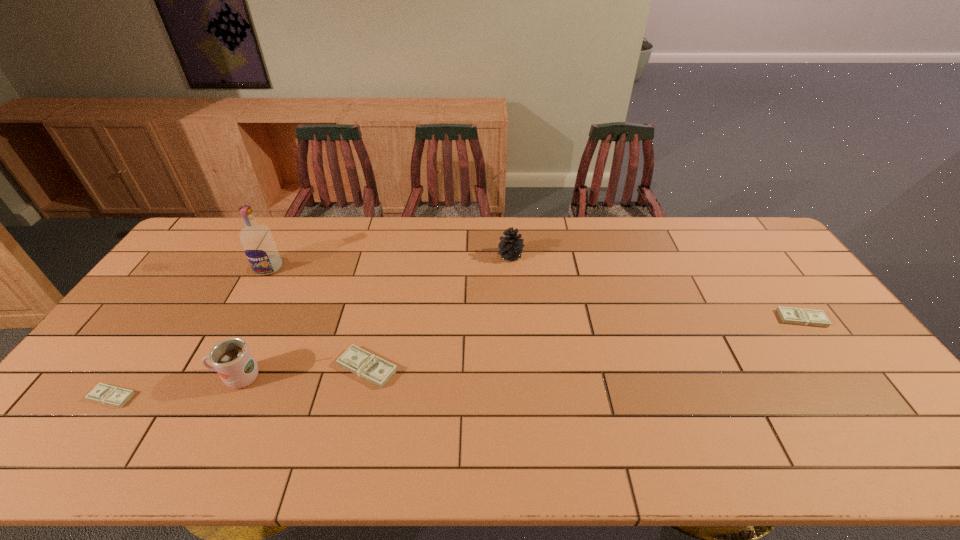
The height and width of the screenshot is (540, 960). In order to click on blank region between the fifth object from left to right and the leftmost money in this screenshot , I will do `click(311, 326)`.

The width and height of the screenshot is (960, 540). In order to click on free space between the second shortest object and the cup in this screenshot , I will do `click(519, 348)`.

Identify the location of vacant region between the tallest object and the fourth tallest object. This screenshot has width=960, height=540. (318, 318).

Locate an element on the screen. The width and height of the screenshot is (960, 540). free space between the tallest object and the second object from right to left is located at coordinates (390, 262).

The height and width of the screenshot is (540, 960). I want to click on blank region between the second tallest money and the fourth shortest object, so click(656, 287).

You are a GUI agent. You are given a task and a screenshot of the screen. Output one action in this format:
    pyautogui.click(x=<x>, y=<y>)
    Task: Click on the empty space that is in between the tallest object and the rightmost object
    
    Given the screenshot: What is the action you would take?
    pyautogui.click(x=535, y=293)

Select which object is the fifth closest to the vodka. Please provide its 2D coordinates. Your answer should be formatted as a tuple, i.e. [(x, y)], where the tuple contains the x and y coordinates of a point satisfying the conditions above.

[(800, 316)]

Identify which object is the fifth closest to the leftmost object. Please provide its 2D coordinates. Your answer should be formatted as a tuple, i.e. [(x, y)], where the tuple contains the x and y coordinates of a point satisfying the conditions above.

[(800, 316)]

Identify the location of the second closest money relative to the leftmost object. Image resolution: width=960 pixels, height=540 pixels. (800, 316).

This screenshot has width=960, height=540. What are the coordinates of `money object that ranks as the closest to the tallest money` in the screenshot? It's located at (110, 395).